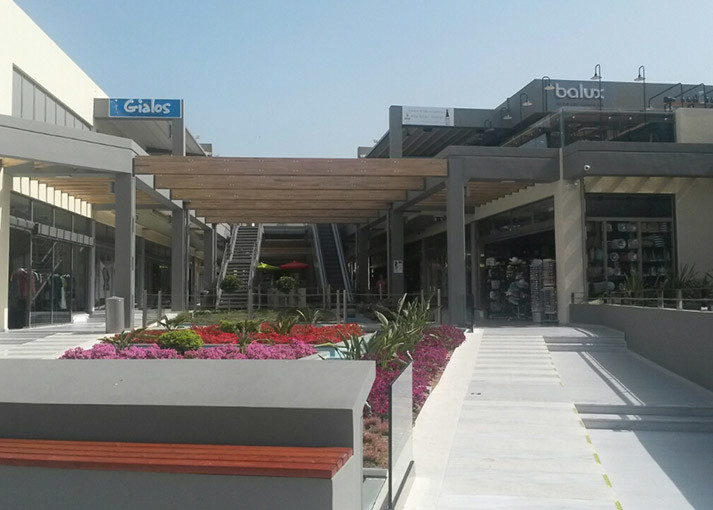
I want to click on steps and stairs, so click(671, 454), click(657, 422), click(632, 378), click(583, 344), click(578, 335), click(235, 301), click(241, 242).